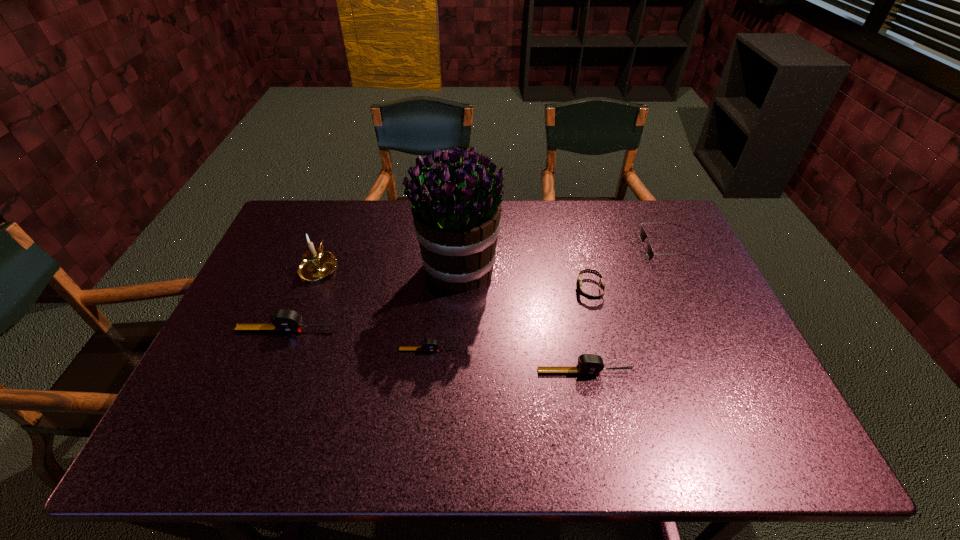
Locate an element on the screen. free space located on the front-facing side of the sunglasses is located at coordinates (542, 247).

What are the coordinates of `vacant space located 0.350m on the front-facing side of the sunglasses` in the screenshot? It's located at point(533,247).

The height and width of the screenshot is (540, 960). Find the location of `free spot located on the front-facing side of the sunglasses`. free spot located on the front-facing side of the sunglasses is located at coordinates (600, 247).

Find the location of a particular element. This screenshot has width=960, height=540. bouquet present at the far edge is located at coordinates (456, 215).

Identify the location of sunglasses at the far edge. (642, 234).

At what (x,y) coordinates should I click in order to perform the action: click on tape measure that is positioned at the left edge. Please return your answer as a coordinate pair (x, y). Looking at the image, I should click on (282, 320).

Find the location of `candle holder that is at the left edge`. candle holder that is at the left edge is located at coordinates (317, 264).

What are the coordinates of `object positioned at the right edge` in the screenshot? It's located at (642, 234).

The image size is (960, 540). In order to click on object at the far right corner in this screenshot , I will do `click(642, 234)`.

Image resolution: width=960 pixels, height=540 pixels. In order to click on vacant space at the far edge of the desktop in this screenshot , I will do `click(409, 228)`.